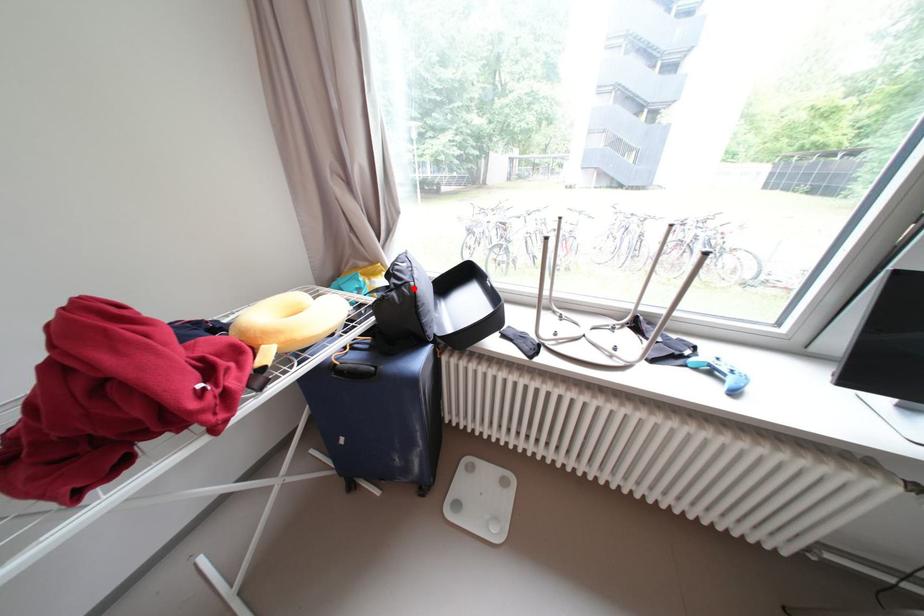
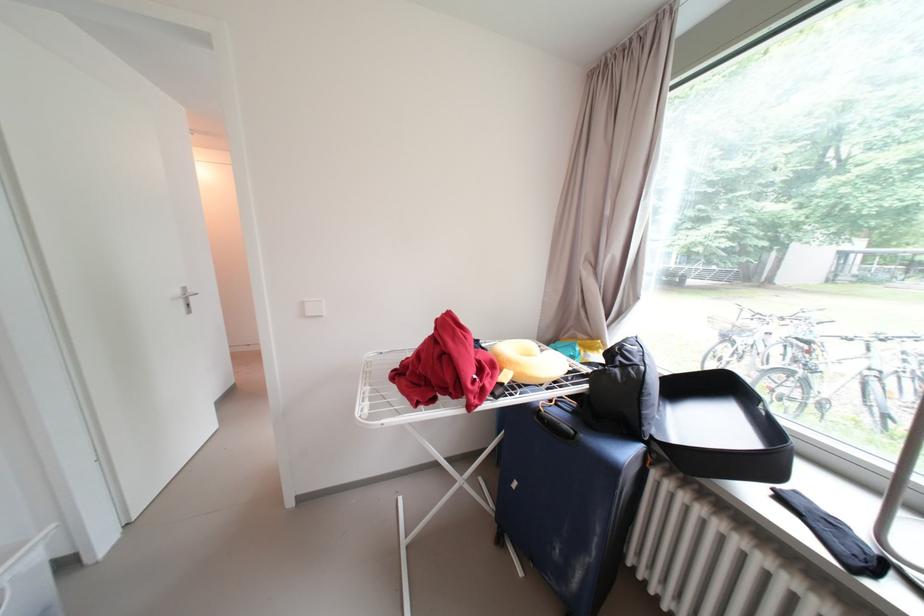
The point at the highlighted location is marked in the first image. Where is the corresponding point in the second image?

(640, 371)